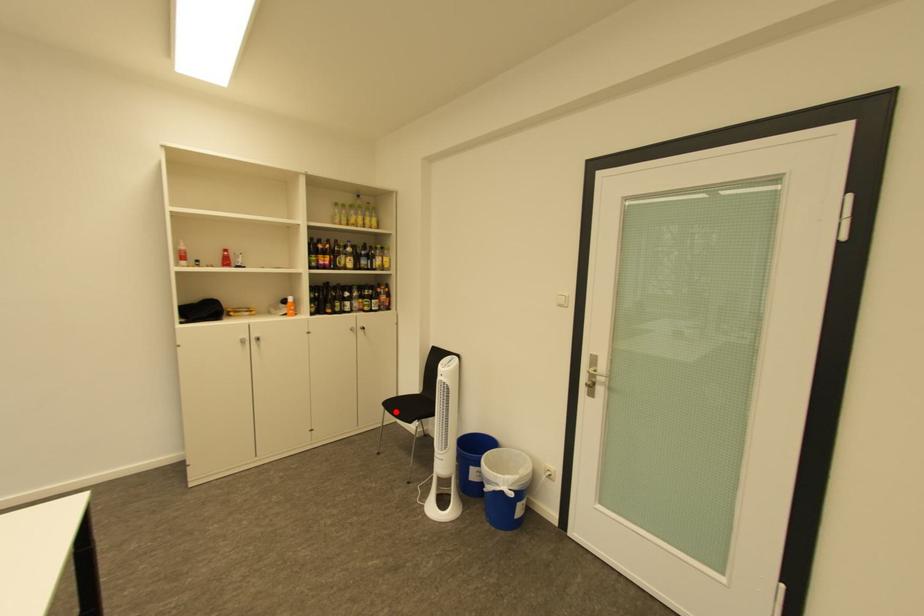
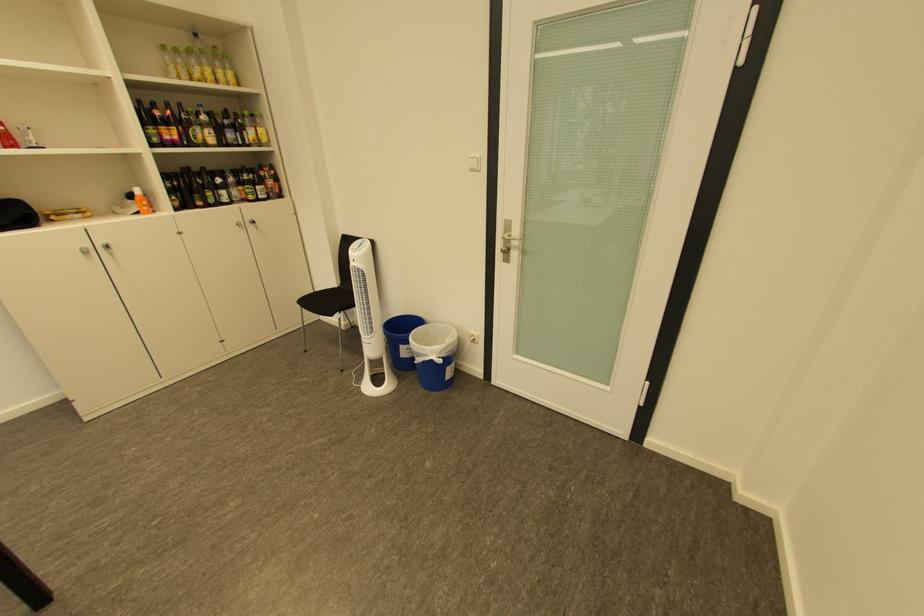
The point at the highlighted location is marked in the first image. Where is the corresponding point in the second image?

(312, 310)